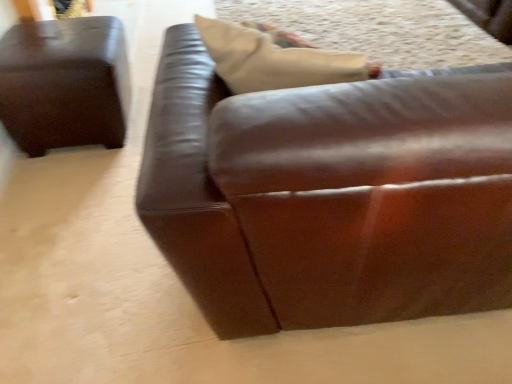
Question: Considering the relative sizes of brown leather ottoman at left, which appears as the 2th studio couch when viewed from the right, and brown leather couch at center, the 1th studio couch when ordered from right to left, in the image provided, is brown leather ottoman at left, which appears as the 2th studio couch when viewed from the right, thinner than brown leather couch at center, the 1th studio couch when ordered from right to left,?

Choices:
 (A) yes
 (B) no

Answer: (A)

Question: Is brown leather ottoman at left, which appears as the 2th studio couch when viewed from the right, taller than brown leather couch at center, which is the 2th studio couch in left-to-right order?

Choices:
 (A) no
 (B) yes

Answer: (A)

Question: Is brown leather ottoman at left, marked as the first studio couch in a left-to-right arrangement, not inside brown leather couch at center, the 1th studio couch when ordered from right to left?

Choices:
 (A) no
 (B) yes

Answer: (B)

Question: Does brown leather ottoman at left, which appears as the 2th studio couch when viewed from the right, have a smaller size compared to brown leather couch at center, which is the 2th studio couch in left-to-right order?

Choices:
 (A) yes
 (B) no

Answer: (A)

Question: From the image's perspective, is brown leather ottoman at left, which appears as the 2th studio couch when viewed from the right, below brown leather couch at center, the 1th studio couch when ordered from right to left?

Choices:
 (A) no
 (B) yes

Answer: (A)

Question: From a real-world perspective, is brown leather ottoman at left, marked as the first studio couch in a left-to-right arrangement, located higher than brown leather couch at center, the 1th studio couch when ordered from right to left?

Choices:
 (A) yes
 (B) no

Answer: (B)

Question: Would you consider brown leather couch at center, the 1th studio couch when ordered from right to left, to be distant from brown leather ottoman at left, marked as the first studio couch in a left-to-right arrangement?

Choices:
 (A) no
 (B) yes

Answer: (B)

Question: Does brown leather couch at center, which is the 2th studio couch in left-to-right order, contain brown leather ottoman at left, marked as the first studio couch in a left-to-right arrangement?

Choices:
 (A) yes
 (B) no

Answer: (B)

Question: Can you confirm if brown leather couch at center, the 1th studio couch when ordered from right to left, is bigger than brown leather ottoman at left, marked as the first studio couch in a left-to-right arrangement?

Choices:
 (A) yes
 (B) no

Answer: (A)

Question: From the image's perspective, is brown leather couch at center, the 1th studio couch when ordered from right to left, on top of brown leather ottoman at left, marked as the first studio couch in a left-to-right arrangement?

Choices:
 (A) no
 (B) yes

Answer: (A)

Question: Can you confirm if brown leather couch at center, which is the 2th studio couch in left-to-right order, is wider than brown leather ottoman at left, which appears as the 2th studio couch when viewed from the right?

Choices:
 (A) yes
 (B) no

Answer: (A)

Question: From a real-world perspective, is brown leather couch at center, the 1th studio couch when ordered from right to left, on brown leather ottoman at left, marked as the first studio couch in a left-to-right arrangement?

Choices:
 (A) no
 (B) yes

Answer: (B)

Question: From a real-world perspective, relative to brown leather ottoman at left, marked as the first studio couch in a left-to-right arrangement, is brown leather couch at center, the 1th studio couch when ordered from right to left, vertically above or below?

Choices:
 (A) below
 (B) above

Answer: (B)